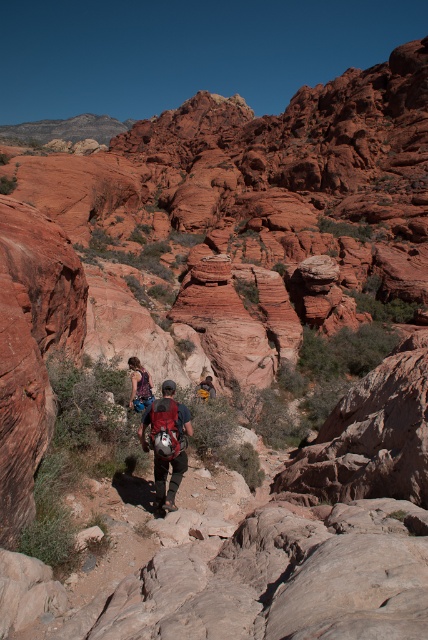
Can you confirm if matte red backpack at center is taller than denim jacket at center?

Yes, matte red backpack at center is taller than denim jacket at center.

Where is `matte red backpack at center`? matte red backpack at center is located at coordinates (168, 442).

Consider the image. Between matte red backpack at center and brown leather backpack at center, which one is positioned higher?

brown leather backpack at center

Which is more to the left, matte red backpack at center or brown leather backpack at center?

matte red backpack at center is more to the left.

Does point (178, 420) come in front of point (208, 378)?

That is True.

The image size is (428, 640). Find the location of `matte red backpack at center`. matte red backpack at center is located at coordinates (168, 442).

What do you see at coordinates (139, 385) in the screenshot? Image resolution: width=428 pixels, height=640 pixels. I see `denim jacket at center` at bounding box center [139, 385].

Between denim jacket at center and brown leather backpack at center, which one has less height?

brown leather backpack at center is shorter.

Which is in front, point (136, 376) or point (205, 385)?

Point (136, 376) is in front.

At what (x,y) coordinates should I click in order to perform the action: click on denim jacket at center. Please return your answer as a coordinate pair (x, y). Looking at the image, I should click on (139, 385).